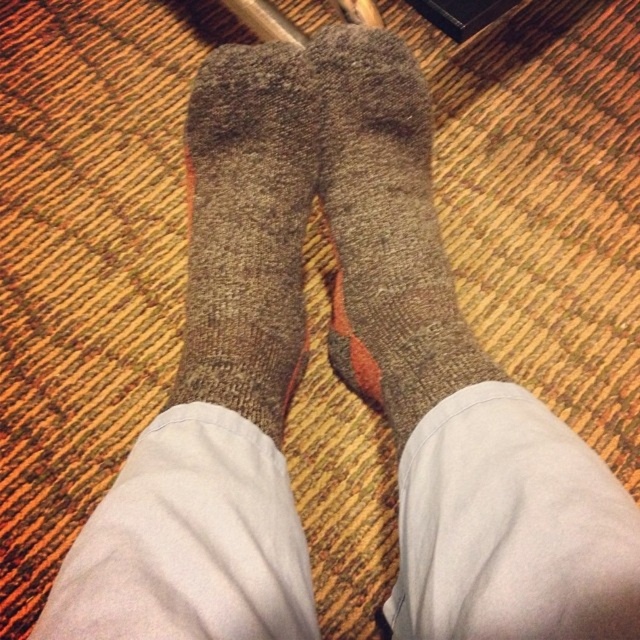
You are trying to decide which sock to wear based on size. You have the woolen socks at center and the gray woolen sock at center in front of you. Which one is larger?

The woolen socks at center is larger than the gray woolen sock at center according to the description.

You are a photographer setting up a shoot. You need to adjust the lighting so that the gray woolen sock at center is fully visible without being blocked by the woolen socks at center. What adjustment should you make?

The gray woolen sock at center is behind the woolen socks at center, so to make it fully visible, you should move the woolen socks at center out of the way or adjust their position to allow the gray woolen sock at center to be in front.